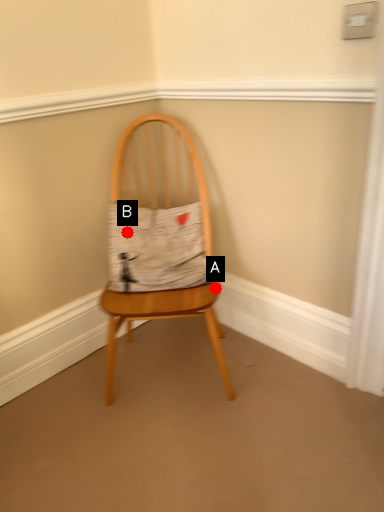
Question: Two points are circled on the image, labeled by A and B beside each circle. Which point is further to the camera?

Choices:
 (A) A is further
 (B) B is further

Answer: (B)